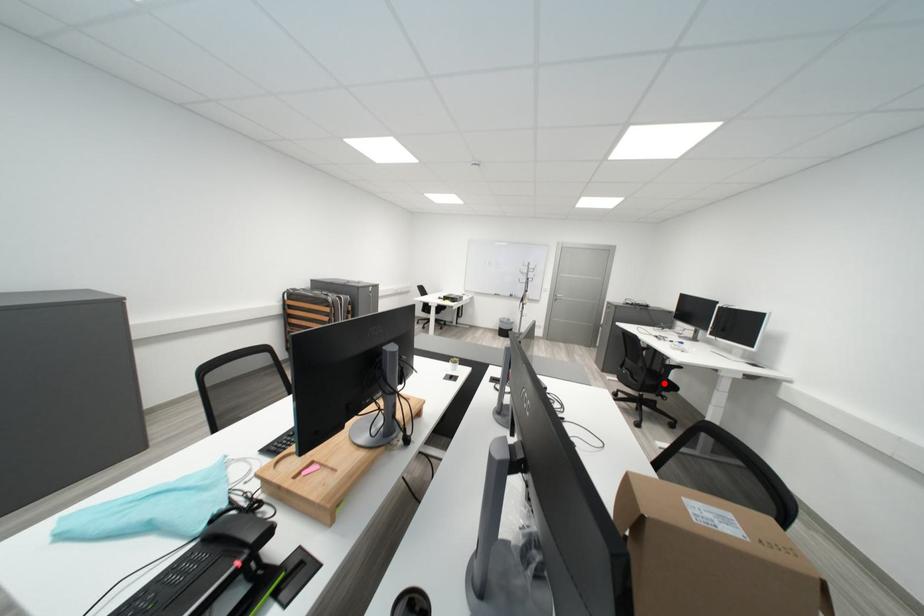
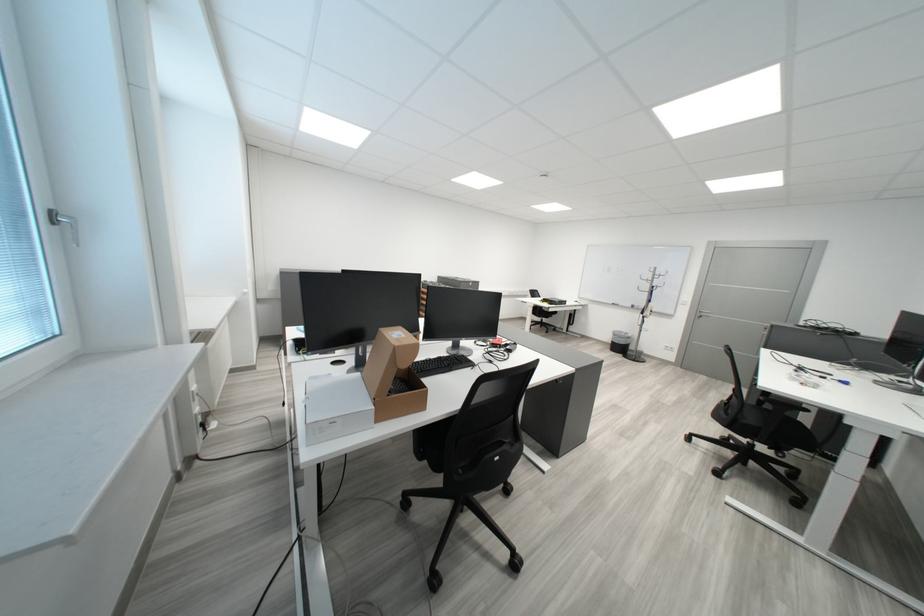
Find the pixel in the second image that matches the highlighted location in the first image.

(763, 422)